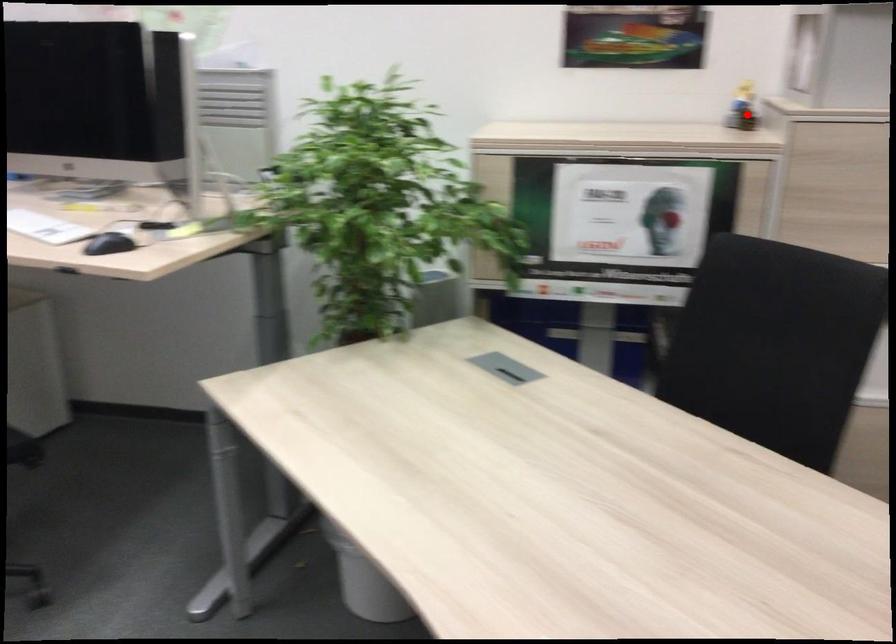
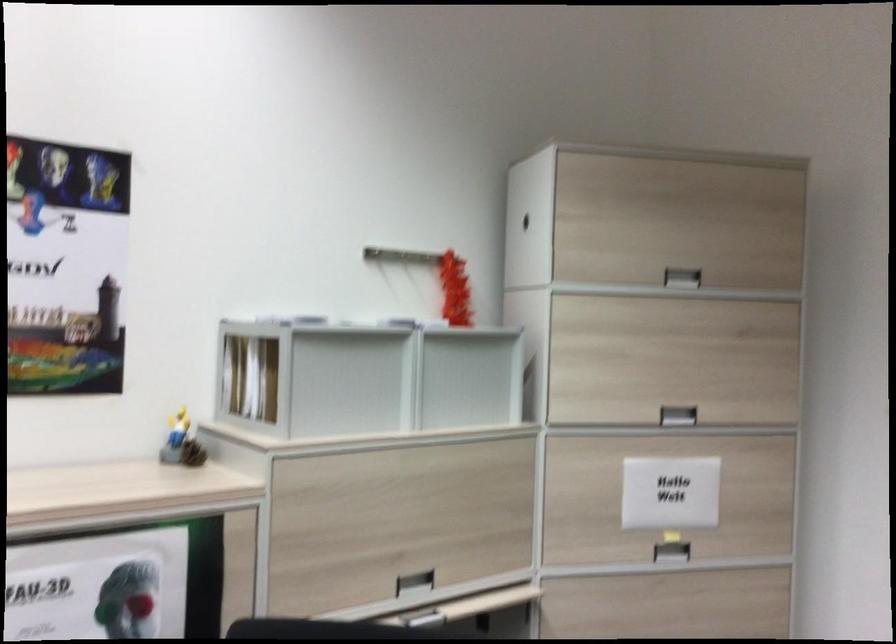
Question: I am providing you with two images of the same scene from different viewpoints. In image1, a red point is highlighted. Considering the same 3D point in image2, which of the following is correct?

Choices:
 (A) It is closer
 (B) It is farther

Answer: (A)